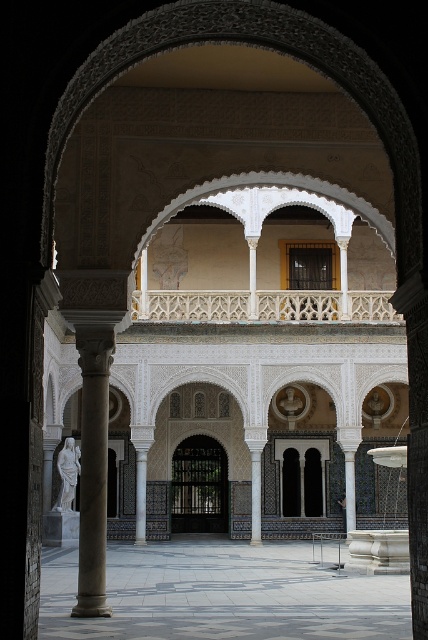
You are planning to place a large potted plant in the courtyard. Given the sizes of the polished stone floor at center and the white marble statue at left, which object would be more suitable for placing the plant without obstructing the view of the courtyard?

The polished stone floor at center has a larger size compared to the white marble statue at left, so placing the large potted plant on the polished stone floor at center would be more suitable as it provides enough space without obstructing the view.

You are standing in the courtyard and want to place a small potted plant on the polished stone floor at center. However, you notice the white marble statue at left. Where exactly should you place the plant so it doesn

The polished stone floor at center is below the white marble statue at left, so placing the plant on the polished stone floor at center would position it directly under the statue. To avoid obstruction, place the plant to the side or behind the statue instead.